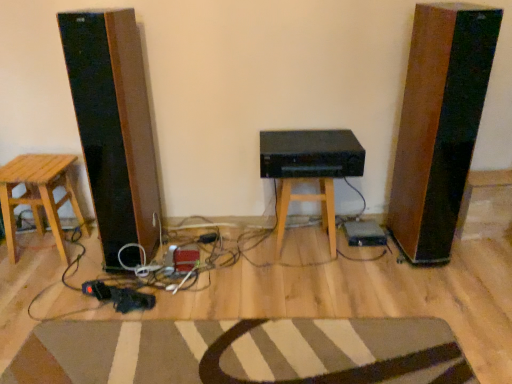
Find the location of `free point in front of wooden stool at left, arranged as the 1th stool when viewed from the left`. free point in front of wooden stool at left, arranged as the 1th stool when viewed from the left is located at coordinates (38, 281).